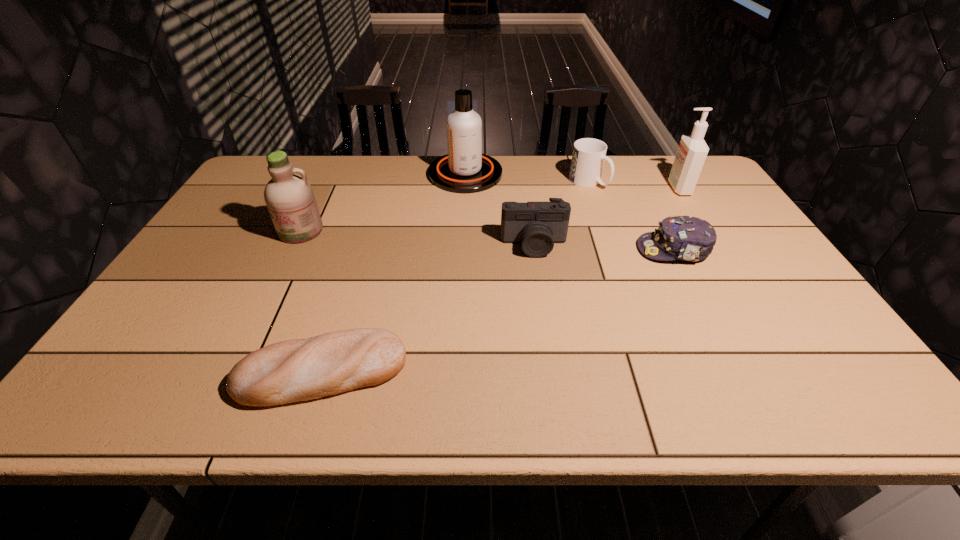
Locate an element on the screen. This screenshot has width=960, height=540. cleansing agent situated at the right edge is located at coordinates (692, 151).

Where is `headwear that is at the right edge`? Image resolution: width=960 pixels, height=540 pixels. headwear that is at the right edge is located at coordinates coord(687,238).

This screenshot has width=960, height=540. I want to click on object at the far right corner, so click(692, 151).

The height and width of the screenshot is (540, 960). In order to click on vacant space at the far edge of the desktop in this screenshot , I will do `click(342, 164)`.

Identify the location of free location at the near edge. The height and width of the screenshot is (540, 960). (451, 394).

At what (x,y) coordinates should I click in order to perform the action: click on free space at the left edge of the desktop. Please return your answer as a coordinate pair (x, y). Looking at the image, I should click on (195, 310).

The image size is (960, 540). In the image, there is a desktop. Find the location of `free space at the right edge`. free space at the right edge is located at coordinates (732, 261).

I want to click on vacant space at the far right corner of the desktop, so click(x=660, y=157).

You are a GUI agent. You are given a task and a screenshot of the screen. Output one action in this format:
    pyautogui.click(x=<x>, y=<y>)
    Task: Click on the free region at the near right corner
    The image size is (960, 540).
    Given the screenshot: What is the action you would take?
    pyautogui.click(x=863, y=380)

Where is `free space between the rightmost cleansing agent and the mug`? free space between the rightmost cleansing agent and the mug is located at coordinates (634, 185).